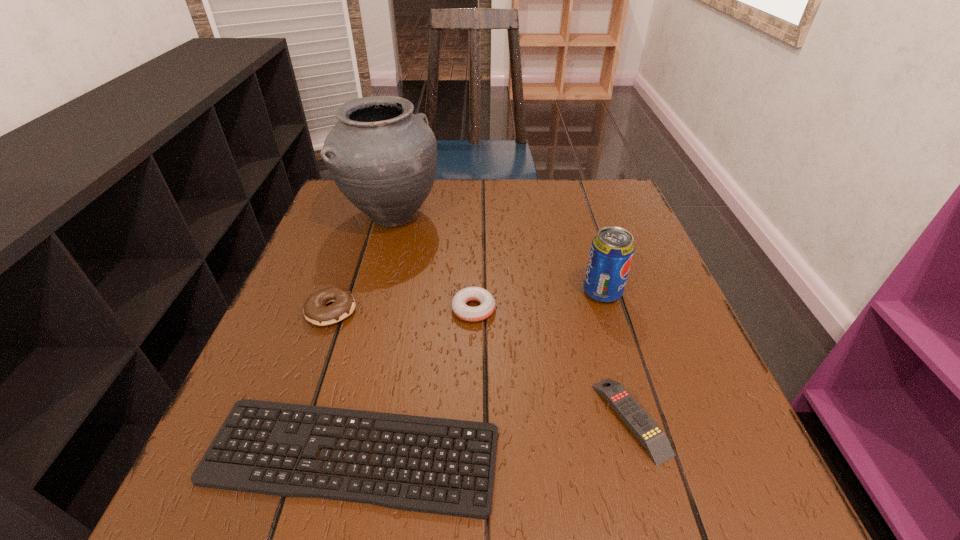
Where is `the tallest object`? the tallest object is located at coordinates (383, 158).

Where is `the farthest object`? the farthest object is located at coordinates (383, 158).

This screenshot has width=960, height=540. I want to click on the second tallest object, so click(x=612, y=249).

You are a GUI agent. You are given a task and a screenshot of the screen. Output one action in this format:
    pyautogui.click(x=<x>, y=<y>)
    Task: Click on the taller doughnut
    The width and height of the screenshot is (960, 540).
    Given the screenshot: What is the action you would take?
    pyautogui.click(x=315, y=310)

The height and width of the screenshot is (540, 960). In order to click on the fourth shortest object in this screenshot , I will do `click(315, 310)`.

Where is `the right doughnut`? the right doughnut is located at coordinates (472, 314).

Identify the location of the shorter doughnut. (472, 314).

You are a GUI agent. You are given a task and a screenshot of the screen. Output one action in this format:
    pyautogui.click(x=<x>, y=<y>)
    Task: Click on the fifth tallest object
    This screenshot has height=540, width=960.
    Given the screenshot: What is the action you would take?
    pyautogui.click(x=651, y=436)

Find the location of a particular element. Image resolution: width=960 pixels, height=540 pixels. the shortest object is located at coordinates (208, 474).

Locate an element on the screen. Image resolution: width=960 pixels, height=540 pixels. vacant point located on the back of the urn is located at coordinates (402, 179).